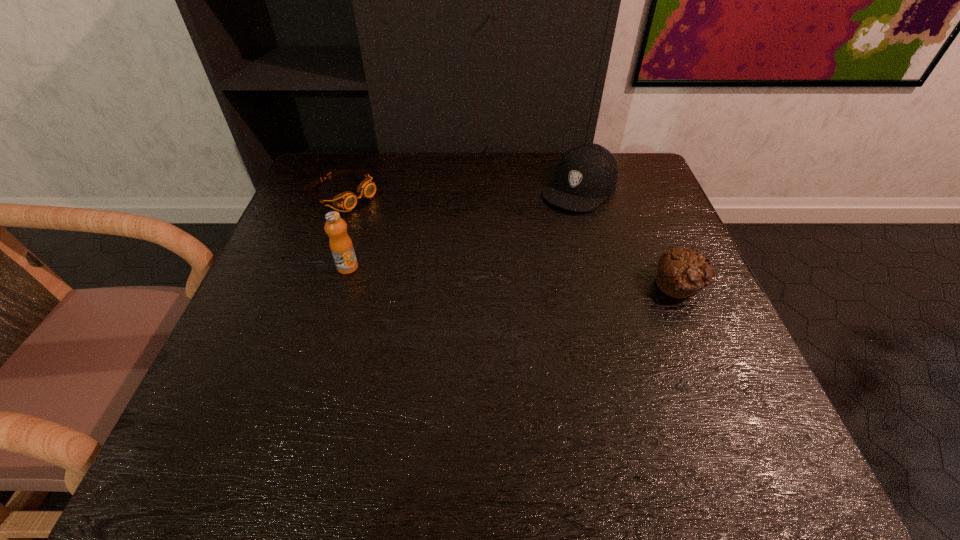
In order to click on orange juice in this screenshot , I will do `click(340, 243)`.

I want to click on the second shortest object, so click(681, 271).

Find the location of a particular element. the third shortest object is located at coordinates (587, 173).

Where is `goggles`? This screenshot has height=540, width=960. goggles is located at coordinates tap(347, 200).

This screenshot has width=960, height=540. In order to click on free space located on the front label of the tallest object in this screenshot , I will do `click(306, 407)`.

The width and height of the screenshot is (960, 540). Find the location of `vacant region located on the back of the third tallest object`. vacant region located on the back of the third tallest object is located at coordinates (652, 221).

Identify the location of vacant space located on the front-facing side of the cap. (503, 264).

Locate an element on the screen. The width and height of the screenshot is (960, 540). vacant space located 0.150m on the front-facing side of the cap is located at coordinates (528, 240).

You are a GUI agent. You are given a task and a screenshot of the screen. Output one action in this format:
    pyautogui.click(x=<x>, y=<y>)
    Task: Click on the vacant space located 0.190m on the front-facing side of the cap
    
    Given the screenshot: What is the action you would take?
    pyautogui.click(x=518, y=249)

Identify the location of vacant space located 0.210m with the lenses facing forward on the shortest object. (427, 240).